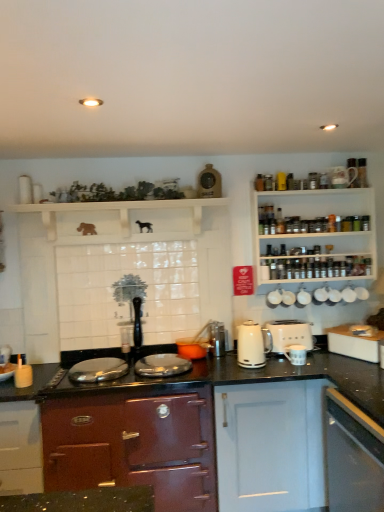
Question: From a real-world perspective, is white glossy cabinet at lower right, the third cabinetry in the left-to-right sequence, positioned over white glossy cup at upper right, the 2th appliance in the right-to-left sequence, based on gravity?

Choices:
 (A) no
 (B) yes

Answer: (A)

Question: Is white glossy cabinet at lower right, arranged as the 1th cabinetry when viewed from the right, positioned before white glossy cup at upper right, the 3th appliance positioned from the bottom?

Choices:
 (A) no
 (B) yes

Answer: (B)

Question: From a real-world perspective, is white glossy cabinet at lower right, the third cabinetry in the left-to-right sequence, beneath white glossy cup at upper right, the 3th appliance positioned from the bottom?

Choices:
 (A) no
 (B) yes

Answer: (B)

Question: Are white glossy cabinet at lower right, arranged as the 1th cabinetry when viewed from the right, and white glossy cup at upper right, which is counted as the fourth appliance, starting from the left, far apart?

Choices:
 (A) no
 (B) yes

Answer: (B)

Question: Is white glossy cabinet at lower right, arranged as the 1th cabinetry when viewed from the right, shorter than white glossy cup at upper right, the 2th appliance in the right-to-left sequence?

Choices:
 (A) yes
 (B) no

Answer: (B)

Question: Considering the positions of white matte wooden shelf at upper center and white ceramic mug at lower center, the third appliance when ordered from left to right, in the image, is white matte wooden shelf at upper center taller or shorter than white ceramic mug at lower center, the third appliance when ordered from left to right,?

Choices:
 (A) tall
 (B) short

Answer: (A)

Question: Would you say white matte wooden shelf at upper center is to the left or to the right of white ceramic mug at lower center, the third appliance when ordered from left to right, in the picture?

Choices:
 (A) left
 (B) right

Answer: (A)

Question: From a real-world perspective, is white matte wooden shelf at upper center positioned above or below white ceramic mug at lower center, the third appliance when ordered from left to right?

Choices:
 (A) above
 (B) below

Answer: (A)

Question: Is white matte wooden shelf at upper center situated inside white ceramic mug at lower center, the third appliance when ordered from left to right, or outside?

Choices:
 (A) inside
 (B) outside

Answer: (B)

Question: From their relative heights in the image, would you say white matte wooden shelf at upper center is taller or shorter than metallic silver kettle at center, acting as the fourth appliance starting from the top?

Choices:
 (A) tall
 (B) short

Answer: (A)

Question: From the image's perspective, is white matte wooden shelf at upper center above or below metallic silver kettle at center, which is the 4th appliance in right-to-left order?

Choices:
 (A) above
 (B) below

Answer: (A)

Question: In the image, is white matte wooden shelf at upper center positioned in front of or behind metallic silver kettle at center, the second appliance from the bottom?

Choices:
 (A) behind
 (B) front

Answer: (B)

Question: In terms of width, does white matte wooden shelf at upper center look wider or thinner when compared to metallic silver kettle at center, the 2th appliance in the left-to-right sequence?

Choices:
 (A) wide
 (B) thin

Answer: (A)

Question: Is metallic silver kettle at center, the 2th appliance in the left-to-right sequence, inside or outside of white wooden spice rack at upper right?

Choices:
 (A) outside
 (B) inside

Answer: (A)

Question: In terms of size, does metallic silver kettle at center, acting as the fourth appliance starting from the top, appear bigger or smaller than white wooden spice rack at upper right?

Choices:
 (A) small
 (B) big

Answer: (A)